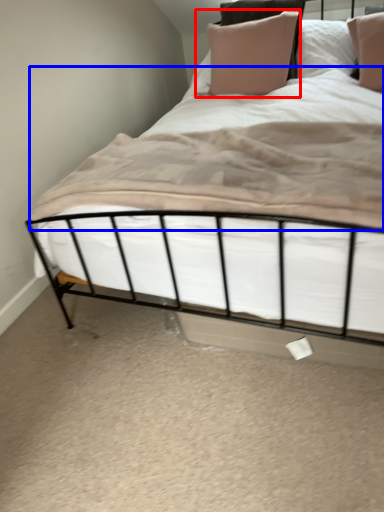
Question: Which object appears closest to the camera in this image, pillow (highlighted by a red box) or sheet (highlighted by a blue box)?

Choices:
 (A) pillow
 (B) sheet

Answer: (B)